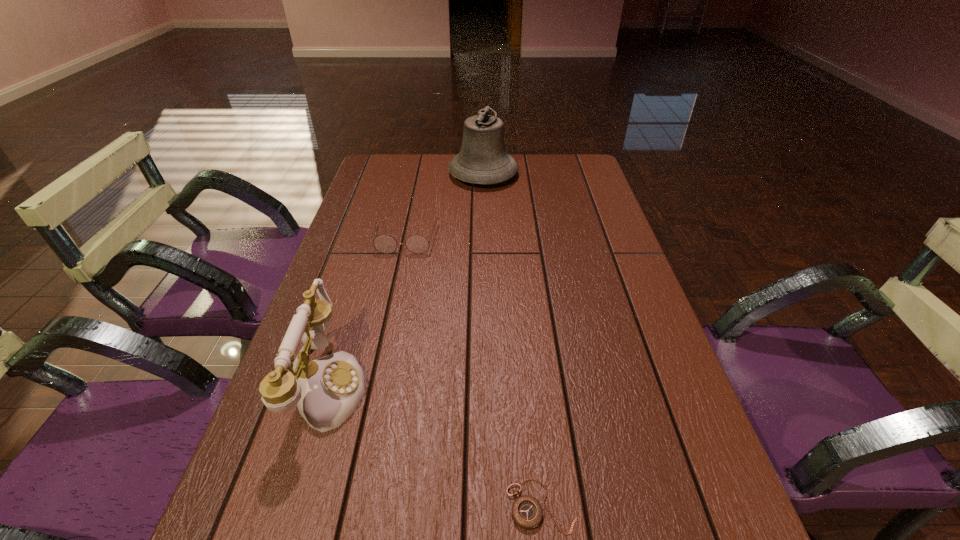
Find the location of `the third closest object to the second shortest object`. the third closest object to the second shortest object is located at coordinates (527, 512).

Identify which object is located as the second nearest to the pocket watch. Please provide its 2D coordinates. Your answer should be formatted as a tuple, i.e. [(x, y)], where the tuple contains the x and y coordinates of a point satisfying the conditions above.

[(386, 244)]

Identify the location of free spot that satisfies the following two spatial constraints: 1. on the dial of the telephone; 2. on the left side of the shortest object. (289, 505).

Where is `vacant region that satisfies the following two spatial constraints: 1. on the front side of the tallest object; 2. on the dial of the third farthest object`? Image resolution: width=960 pixels, height=540 pixels. vacant region that satisfies the following two spatial constraints: 1. on the front side of the tallest object; 2. on the dial of the third farthest object is located at coordinates (486, 386).

Find the location of a particular element. The height and width of the screenshot is (540, 960). free space in the image that satisfies the following two spatial constraints: 1. on the back side of the nearest object; 2. on the dial of the second nearest object is located at coordinates (529, 386).

This screenshot has height=540, width=960. What are the coordinates of `vacant space that satisfies the following two spatial constraints: 1. on the temples of the nearest object; 2. on the right side of the third tallest object` in the screenshot? It's located at (348, 505).

You are a GUI agent. You are given a task and a screenshot of the screen. Output one action in this format:
    pyautogui.click(x=<x>, y=<y>)
    Task: Click on the vacant space that satisfies the following two spatial constraints: 1. on the dial of the nearest object; 2. on the left side of the second tallest object
    The width and height of the screenshot is (960, 540).
    Given the screenshot: What is the action you would take?
    coord(289,505)

The width and height of the screenshot is (960, 540). Identify the location of vacant space that satisfies the following two spatial constraints: 1. on the temples of the pocket watch; 2. on the left side of the second shortest object. (348, 505).